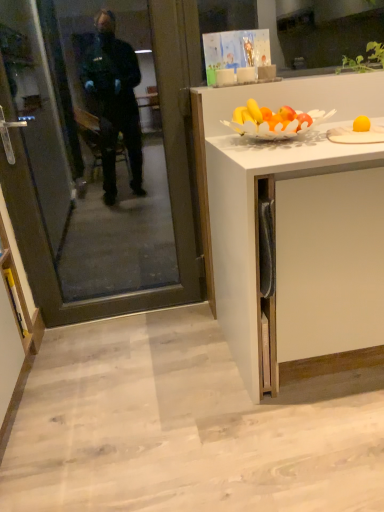
Question: Considering the positions of white matte cabinet at right, acting as the 2th cabinetry starting from the left, and yellow marker at lower left, placed as the first cabinetry when sorted from left to right, in the image, is white matte cabinet at right, acting as the 2th cabinetry starting from the left, taller or shorter than yellow marker at lower left, placed as the first cabinetry when sorted from left to right,?

Choices:
 (A) tall
 (B) short

Answer: (A)

Question: Relative to yellow marker at lower left, the second cabinetry when ordered from right to left, is white matte cabinet at right, arranged as the first cabinetry when viewed from the right, in front or behind?

Choices:
 (A) behind
 (B) front

Answer: (B)

Question: Estimate the real-world distances between objects in this image. Which object is farther from the yellow matte plate at upper right?

Choices:
 (A) yellow marker at lower left, placed as the first cabinetry when sorted from left to right
 (B) transparent glass door at left
 (C) white matte cabinet at right, arranged as the first cabinetry when viewed from the right

Answer: (A)

Question: Based on their relative distances, which object is nearer to the yellow matte plate at upper right?

Choices:
 (A) white matte cabinet at right, acting as the 2th cabinetry starting from the left
 (B) yellow marker at lower left, placed as the first cabinetry when sorted from left to right
 (C) transparent glass door at left

Answer: (A)